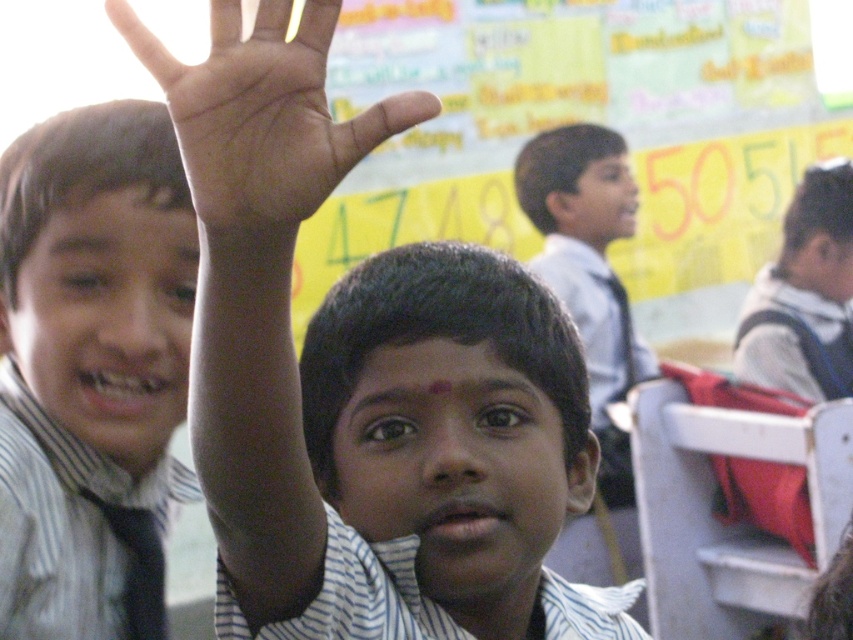
Can you confirm if white striped shirt at center is thinner than dark skin palm at upper center?

In fact, white striped shirt at center might be wider than dark skin palm at upper center.

Is point (482, 291) positioned in front of point (225, 132)?

No, it is behind (225, 132).

At what (x,y) coordinates should I click in order to perform the action: click on white striped shirt at center. Please return your answer as a coordinate pair (x, y). This screenshot has width=853, height=640. Looking at the image, I should click on (364, 380).

Describe the element at coordinates (263, 115) in the screenshot. I see `dark skin palm at upper center` at that location.

Locate an element on the screen. dark skin palm at upper center is located at coordinates (263, 115).

Does white striped shirt at center appear under white fabric backpack at right?

Correct, white striped shirt at center is located below white fabric backpack at right.

Can you confirm if white striped shirt at center is thinner than white fabric backpack at right?

Yes.

Is point (427, 637) behind point (791, 298)?

That is False.

This screenshot has height=640, width=853. Identify the location of white striped shirt at center. (364, 380).